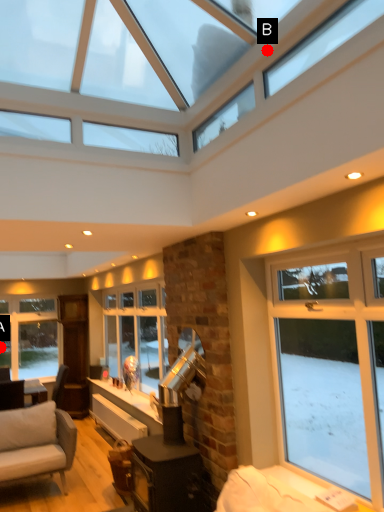
Question: Two points are circled on the image, labeled by A and B beside each circle. Which point appears farthest from the camera in this image?

Choices:
 (A) A is further
 (B) B is further

Answer: (A)